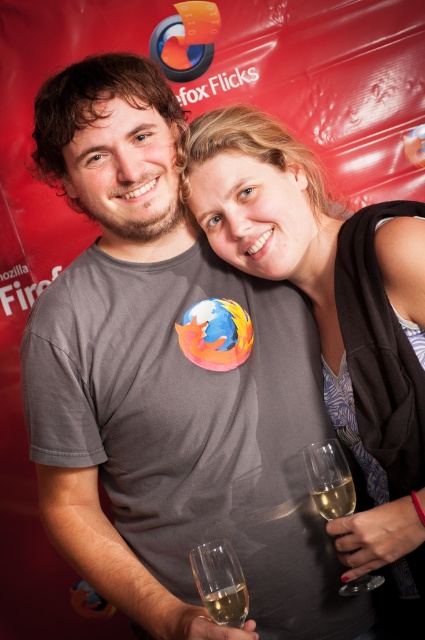
Consider the image. You are at a Firefox event and need to pour champagne into the clear glass wine glass at lower right and the translucent glass at lower center. Which glass should you choose if you want to serve a larger volume of champagne?

The clear glass wine glass at lower right can hold more champagne because it is taller than the translucent glass at lower center.

You are organizing a party and need to decide which item to place on the main table. Given the matte gray shirt at center and the clear glass wine glass at lower right, which one is bigger in size?

The matte gray shirt at center is larger in size than the clear glass wine glass at lower right, so the matte gray shirt at center should be placed on the main table.

You are a photographer at the event and want to ensure both the matte gray shirt at center and the clear glass wine glass at lower right are clearly visible in the photo. Which object should you focus on to ensure both are in frame without moving the camera?

The matte gray shirt at center is wider than the clear glass wine glass at lower right, so focusing on the wider object, the matte gray shirt at center, will ensure both are in frame.